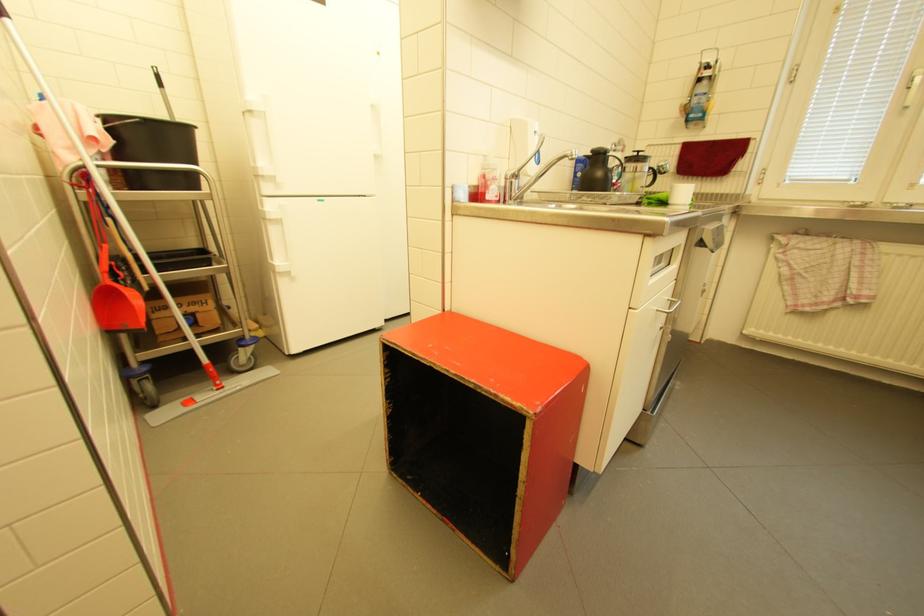
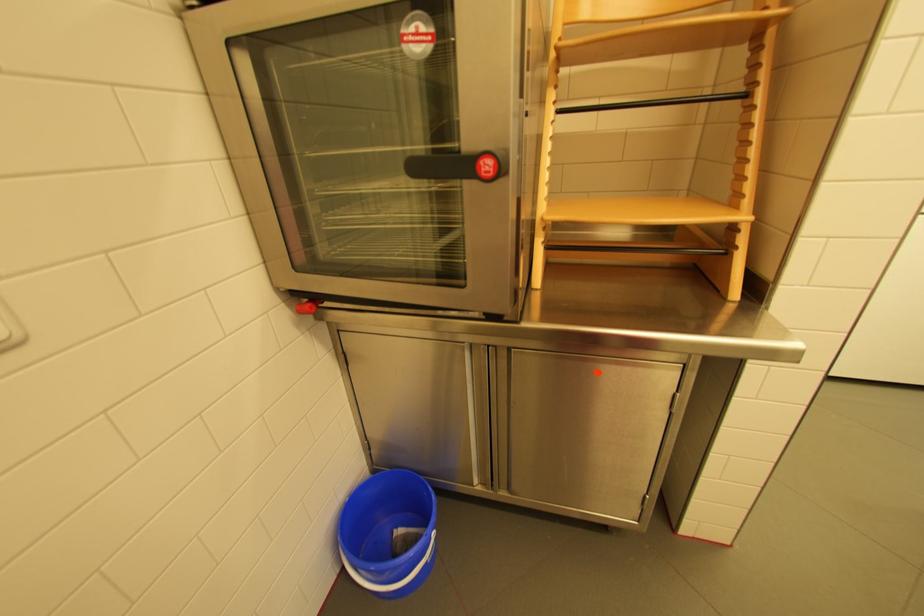
First-person continuous shooting, in which direction is the camera rotating?

The rotation direction of the camera is left-down.